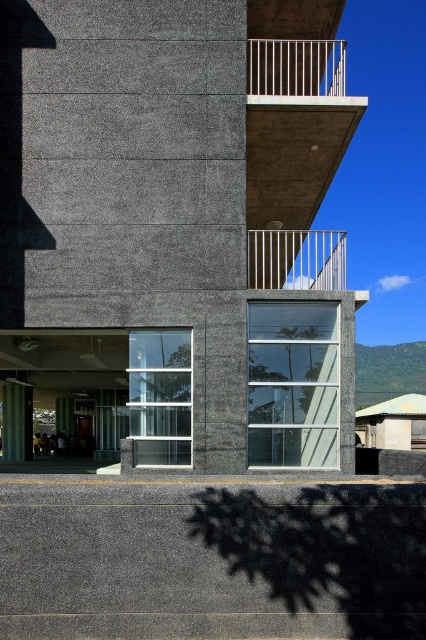
Question: Which of the following is the farthest from the observer?

Choices:
 (A) silver metallic railing at upper center
 (B) gray concrete at lower center
 (C) white metal railing at upper center

Answer: (A)

Question: Does gray concrete at lower center have a smaller size compared to white metal railing at upper center?

Choices:
 (A) no
 (B) yes

Answer: (B)

Question: Is gray concrete at lower center to the right of white metal railing at upper center from the viewer's perspective?

Choices:
 (A) yes
 (B) no

Answer: (B)

Question: Which object is positioned closest to the gray concrete at lower center?

Choices:
 (A) white metal railing at upper center
 (B) silver metallic railing at upper center

Answer: (B)

Question: Which point appears closest to the camera in this image?

Choices:
 (A) tap(336, 275)
 (B) tap(270, 38)
 (C) tap(161, 605)

Answer: (C)

Question: Does silver metallic railing at upper center appear on the left side of white metal railing at upper center?

Choices:
 (A) yes
 (B) no

Answer: (A)